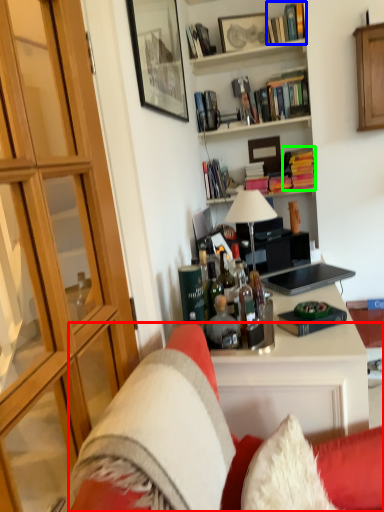
Question: Considering the real-world distances, which object is farthest from studio couch (highlighted by a red box)? book (highlighted by a blue box) or book (highlighted by a green box)?

Choices:
 (A) book
 (B) book

Answer: (A)